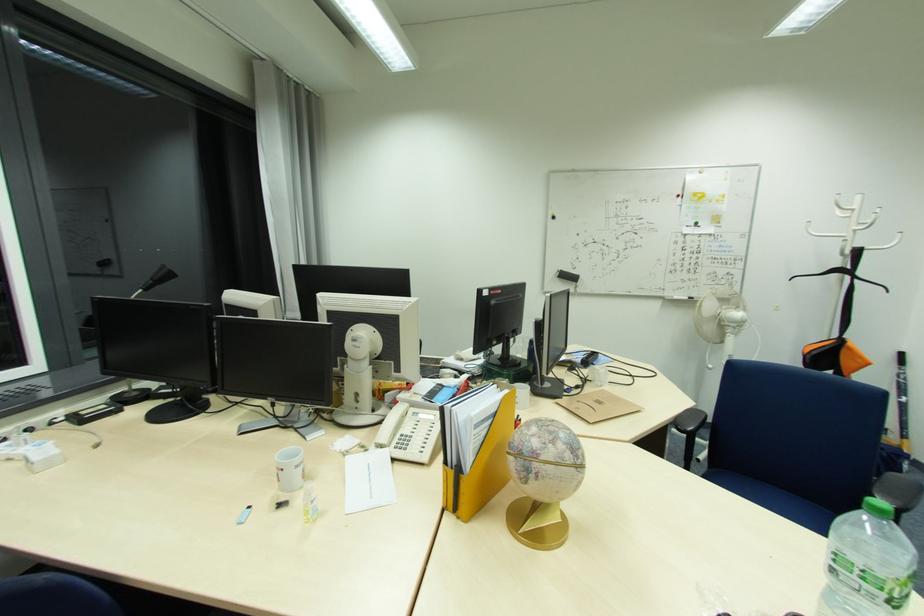
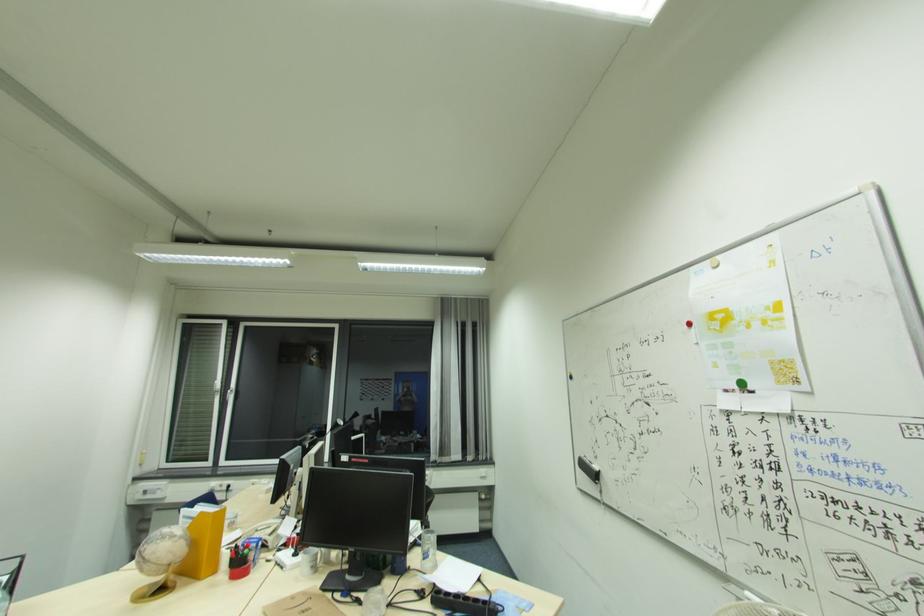
The point at (577, 280) is marked in the first image. Where is the corresponding point in the second image?

(598, 476)